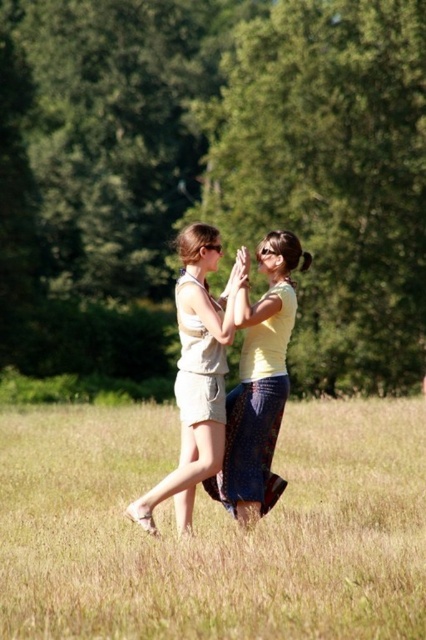
Question: Does green leafy tree at center appear on the left side of grassy field at center?

Choices:
 (A) yes
 (B) no

Answer: (A)

Question: Is green leafy tree at center wider than yellow matte skirt at center?

Choices:
 (A) no
 (B) yes

Answer: (B)

Question: Is green leafy tree at center further to camera compared to yellow matte skirt at center?

Choices:
 (A) no
 (B) yes

Answer: (B)

Question: Which point is closer to the camera?

Choices:
 (A) yellow matte skirt at center
 (B) green leafy tree at center
 (C) beige cotton shorts at center
 (D) grassy field at center

Answer: (D)

Question: Which point appears farthest from the camera in this image?

Choices:
 (A) (221, 348)
 (B) (71, 241)
 (C) (256, 324)

Answer: (B)

Question: Which object appears closest to the camera in this image?

Choices:
 (A) yellow matte skirt at center
 (B) green leafy tree at center
 (C) beige cotton shorts at center
 (D) grassy field at center

Answer: (D)